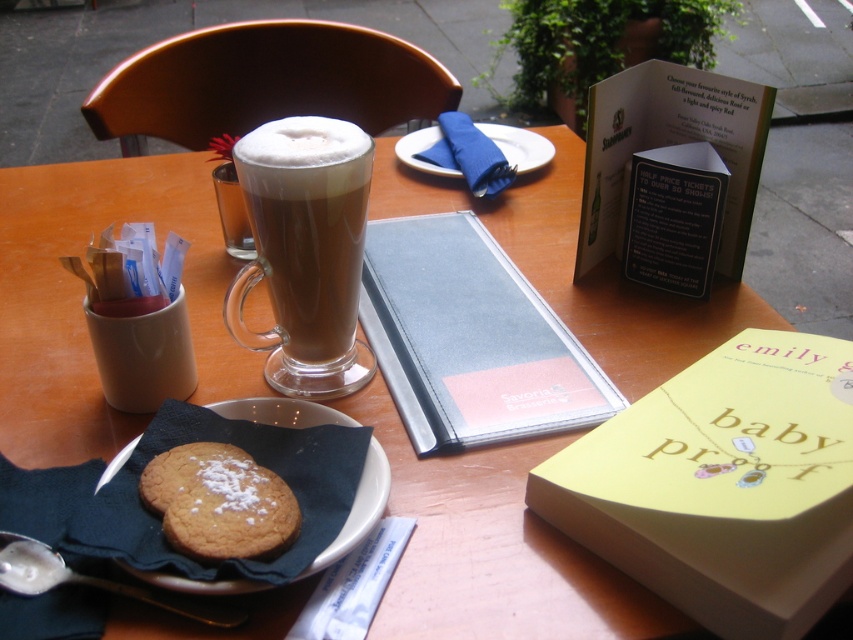
You are a barista arranging items on a table. You need to place a blue leather menu at center and a brown frothy latte at center. Which item should you place first to ensure they both fit on the table?

The blue leather menu at center might be wider than brown frothy latte at center, so you should place the blue leather menu at center first to ensure there is enough space for both items.